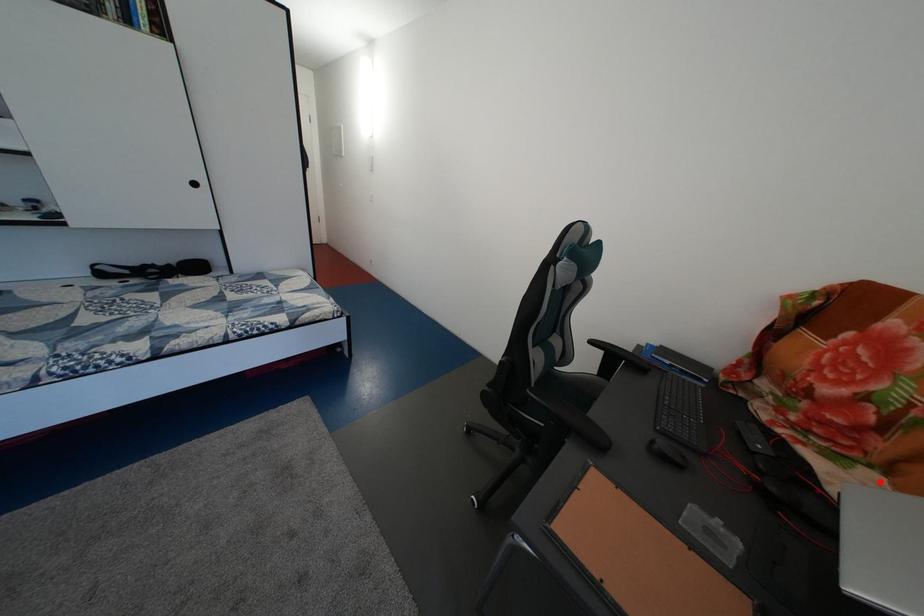
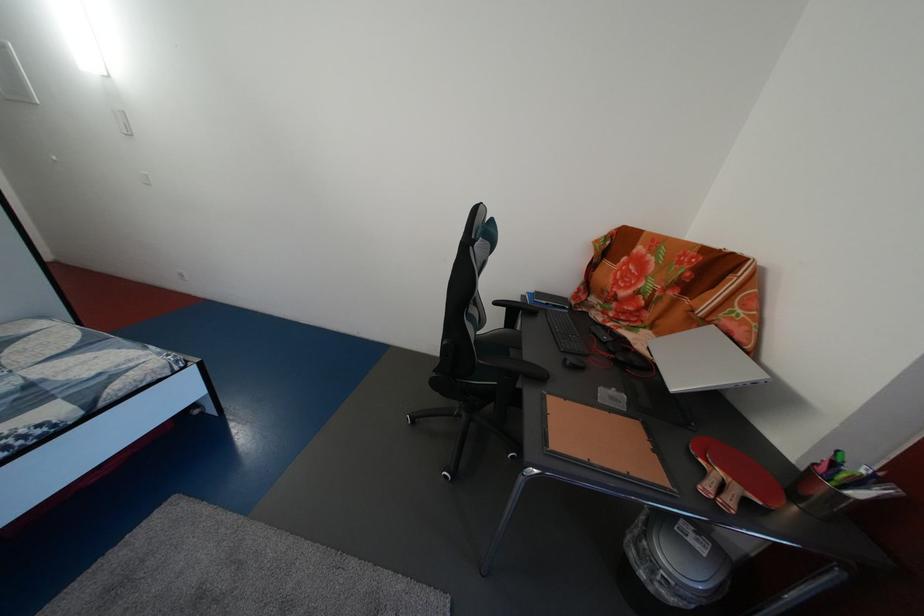
The point at the highlighted location is marked in the first image. Where is the corresponding point in the second image?

(657, 339)